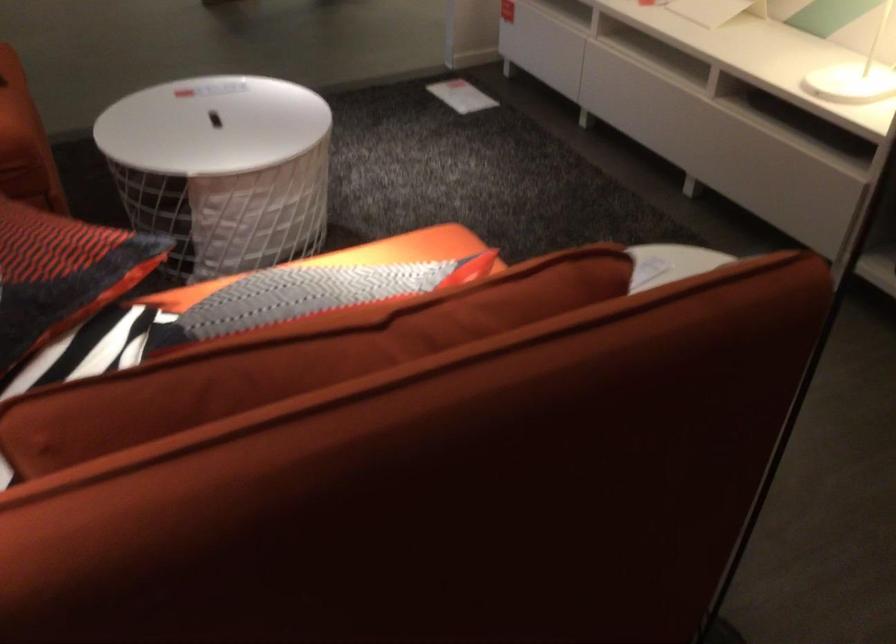
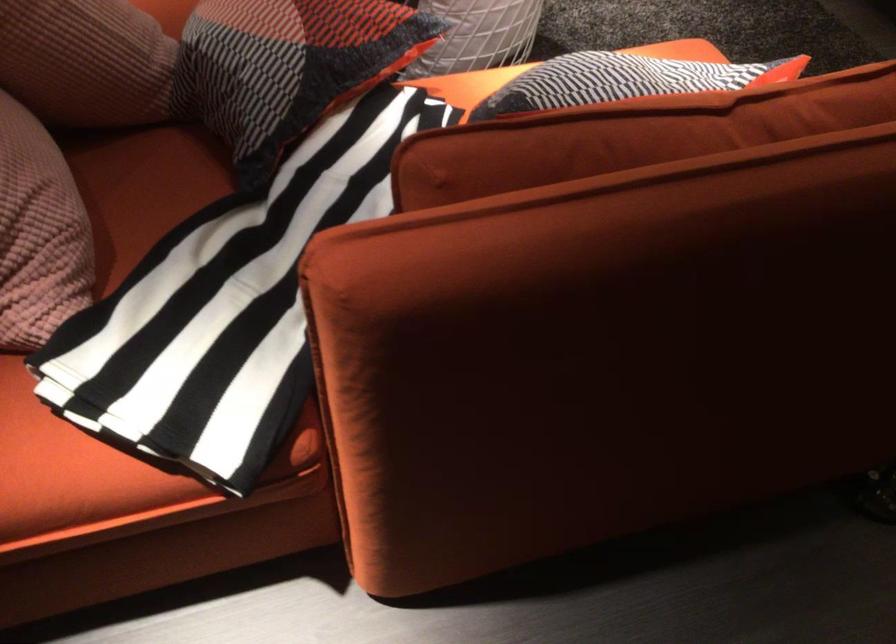
Find the pixel in the second image that matches [303,297] in the first image.

(623, 80)